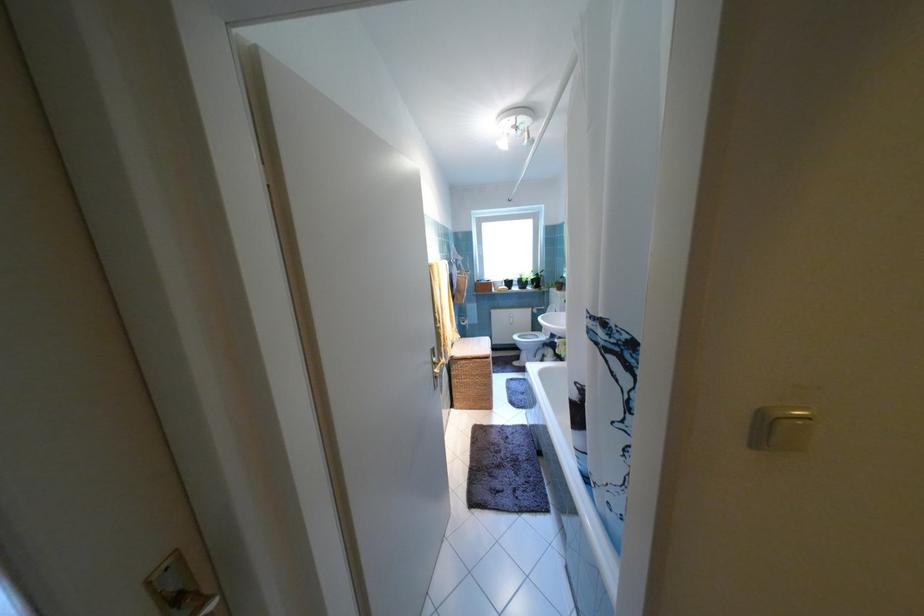
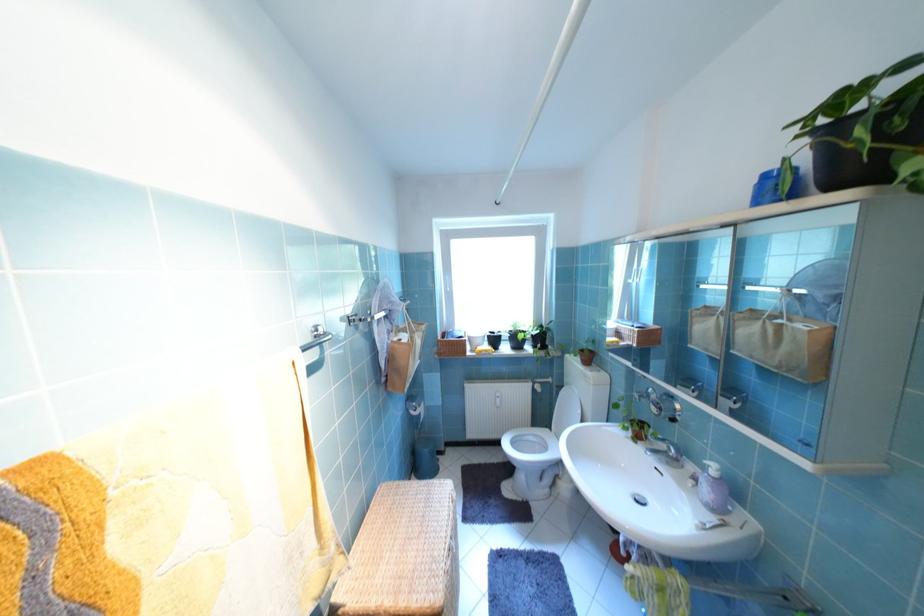
The point at (545, 282) is marked in the first image. Where is the corresponding point in the second image?

(550, 339)